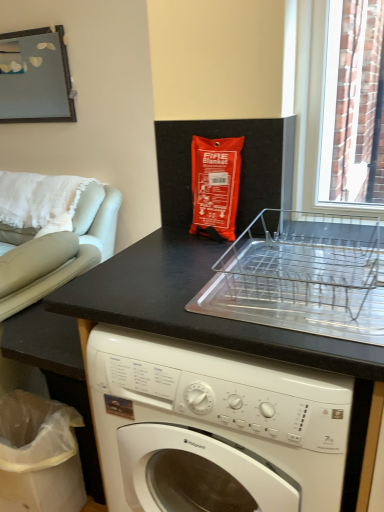
Question: Is white plastic bag at lower left wider or thinner than metallic mirror at upper left?

Choices:
 (A) wide
 (B) thin

Answer: (A)

Question: Is white plastic bag at lower left bigger or smaller than metallic mirror at upper left?

Choices:
 (A) small
 (B) big

Answer: (B)

Question: Which object is the closest to the white cotton pillow at left?

Choices:
 (A) black matte counter at lower left
 (B) clear plastic dish rack at center
 (C) metallic mirror at upper left
 (D) white plastic bag at lower left
 (E) light gray leather armchair at left

Answer: (E)

Question: Estimate the real-world distances between objects in this image. Which object is closer to the white plastic bag at lower left?

Choices:
 (A) black matte counter at lower left
 (B) white cotton pillow at left
 (C) metallic mirror at upper left
 (D) clear plastic dish rack at center
 (E) light gray leather armchair at left

Answer: (A)